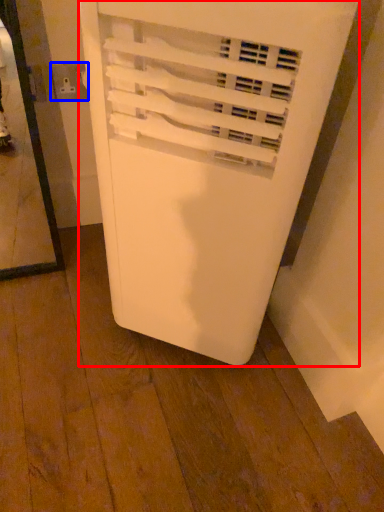
Question: Which of the following is the closest to the observer, home appliance (highlighted by a red box) or electric outlet (highlighted by a blue box)?

Choices:
 (A) home appliance
 (B) electric outlet

Answer: (A)